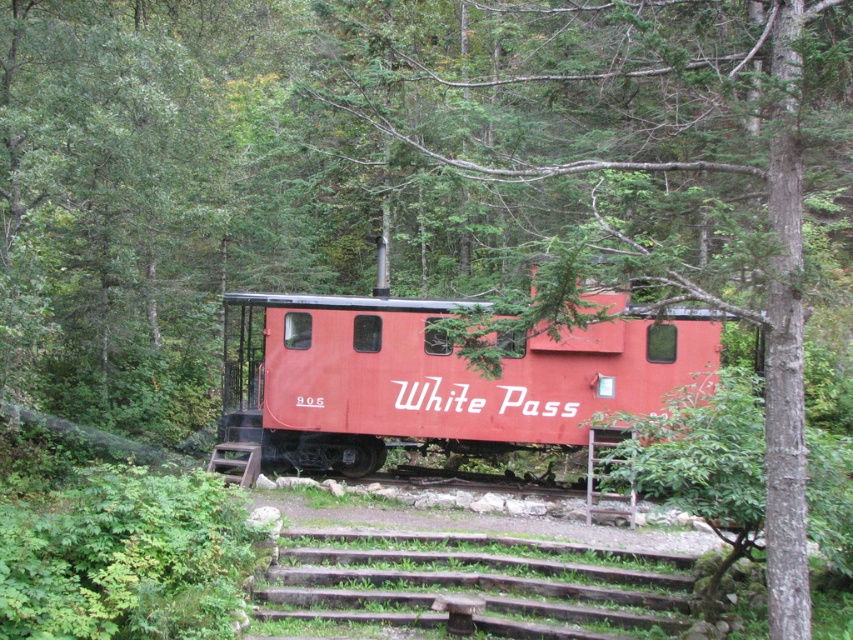
Does green leafy tree at center appear on the left side of matte red caboose at center?

Incorrect, green leafy tree at center is not on the left side of matte red caboose at center.

Which is in front, point (454, 144) or point (370, 330)?

Point (370, 330)

This screenshot has height=640, width=853. Find the location of `green leafy tree at center`. green leafy tree at center is located at coordinates (633, 156).